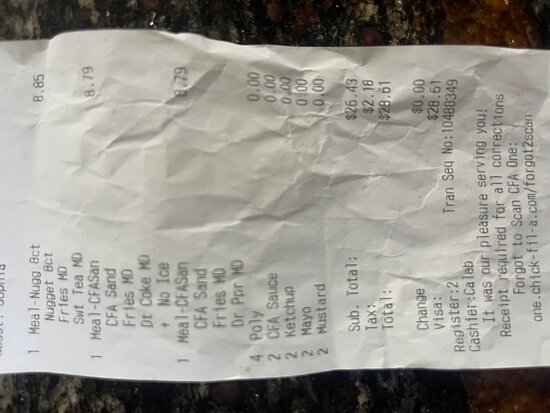
Image resolution: width=550 pixels, height=413 pixels. I want to click on marble surface, so click(x=473, y=25), click(x=351, y=401).